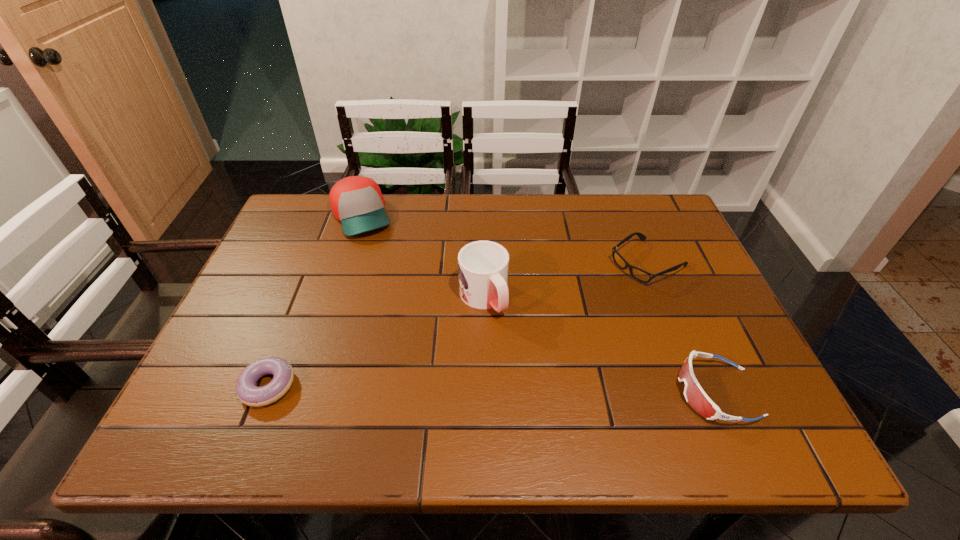
In order to click on object that is at the near right corner in this screenshot , I will do `click(695, 396)`.

In the image, there is a desktop. Identify the location of vacant space at the far edge. (445, 198).

Image resolution: width=960 pixels, height=540 pixels. In the image, there is a desktop. What are the coordinates of `vacant space at the near edge` in the screenshot? It's located at (535, 379).

The height and width of the screenshot is (540, 960). I want to click on vacant space at the left edge, so click(296, 279).

In the image, there is a desktop. Identify the location of vacant space at the right edge. Image resolution: width=960 pixels, height=540 pixels. (691, 296).

Locate an element on the screen. vacant space at the far left corner is located at coordinates [308, 210].

Identify the location of blank region between the third object from right to left and the third tallest object. (600, 345).

Where is `vacant space that is in between the mug and the spectacles`? vacant space that is in between the mug and the spectacles is located at coordinates (565, 280).

This screenshot has height=540, width=960. Find the location of `vacant space in between the mug and the second tallest object`. vacant space in between the mug and the second tallest object is located at coordinates (422, 257).

The height and width of the screenshot is (540, 960). Identify the location of empty location between the second tallest object and the shortest object. (315, 301).